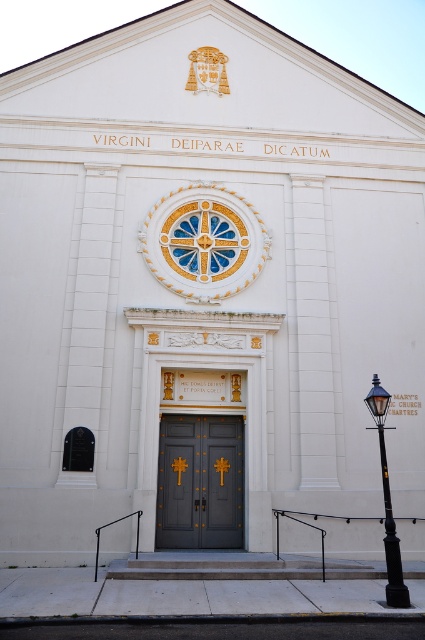
You are a visitor approaching the church from the front entrance. You see the dark gray wood doors at center and the black metal streetlight at lower right. Which object is positioned to the left from your perspective?

The dark gray wood doors at center is to the left of black metal streetlight at lower right.

In the scene shown: You are a visitor standing in front of the church. You notice the dark gray wood doors at center and the black metal streetlight at lower right. Which object is taller?

The dark gray wood doors at center is taller than the black metal streetlight at lower right.

You are standing in front of the church and want to enter through the dark gray wood doors at center. However, the path is blocked by the black metal streetlight at lower right. Can you walk around the streetlight to reach the doors?

The dark gray wood doors at center is located below the black metal streetlight at lower right, meaning the streetlight is above the doors. Since the streetlight is positioned higher up, it does not block the path to the doors, so you can walk around it to reach the doors.